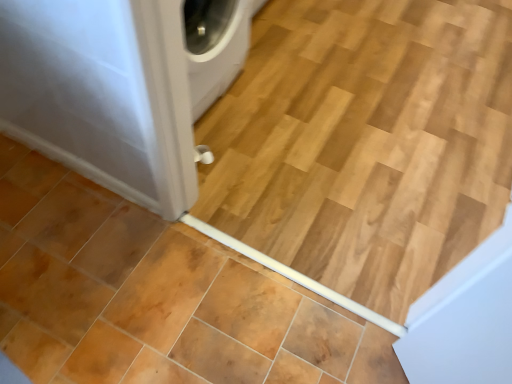
Identify the location of brown matte tile at center. (155, 296).

Describe the element at coordinates (155, 296) in the screenshot. I see `brown matte tile at center` at that location.

At what (x,y) coordinates should I click in order to perform the action: click on brown matte tile at center. Please return your answer as a coordinate pair (x, y). Image resolution: width=512 pixels, height=384 pixels. Looking at the image, I should click on (155, 296).